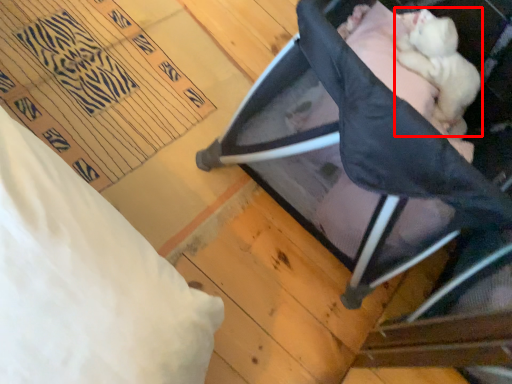
Question: From the image's perspective, considering the relative positions of newborn (annotated by the red box) and furniture in the image provided, where is newborn (annotated by the red box) located with respect to the staircase?

Choices:
 (A) above
 (B) below

Answer: (A)